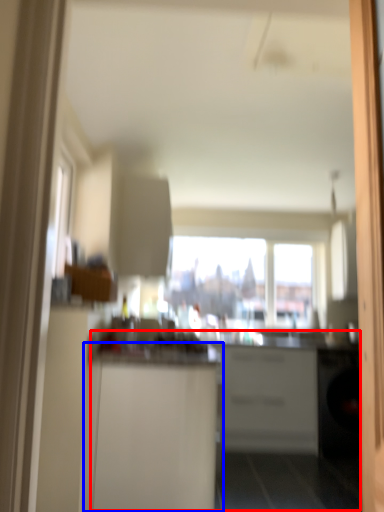
Question: Which of the following is the closest to the observer, counter (highlighted by a red box) or cabinetry (highlighted by a blue box)?

Choices:
 (A) counter
 (B) cabinetry

Answer: (A)